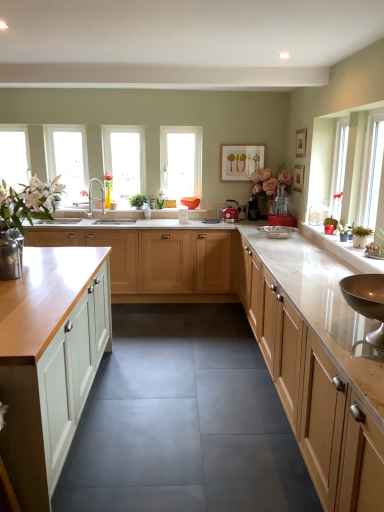
Question: In the image, is translucent glass window at center positioned in front of or behind white painted wood cabinet at left, which ranks as the 3th cabinetry in right-to-left order?

Choices:
 (A) front
 (B) behind

Answer: (B)

Question: From a real-world perspective, relative to white painted wood cabinet at left, which ranks as the 3th cabinetry in right-to-left order, is translucent glass window at center vertically above or below?

Choices:
 (A) above
 (B) below

Answer: (A)

Question: Which object is the farthest from the green leafy plant at center?

Choices:
 (A) wooden picture frame at upper center, the second picture frame positioned from the back
 (B) translucent glass window at center
 (C) clear glass window at center, which appears as the 1th window when viewed from the right
 (D) white marble countertop at center
 (E) red plastic food processor at center, marked as the first appliance in a right-to-left arrangement

Answer: (D)

Question: Which is nearer to the light wood cabinet at center, the 2th cabinetry when ordered from right to left?

Choices:
 (A) white matte picture frame at upper center, the 3th picture frame in the front-to-back sequence
 (B) translucent glass window at center
 (C) white painted wood cabinet at left, which ranks as the 3th cabinetry in right-to-left order
 (D) red plastic food processor at center, marked as the first appliance in a right-to-left arrangement
 (E) light wood cabinet at right, the third cabinetry when ordered from left to right

Answer: (D)